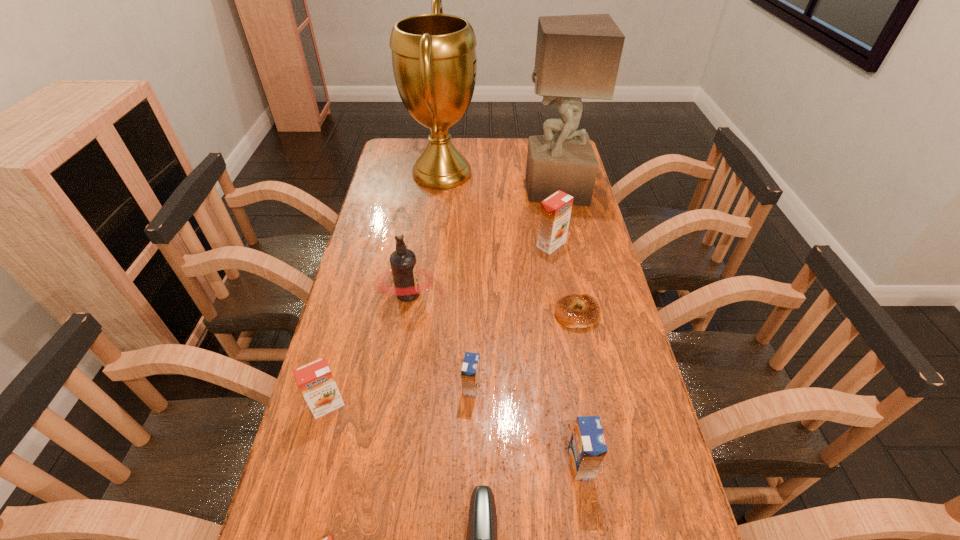
Identify the location of vacant region located 0.390m on the back of the third nearest object. This screenshot has height=540, width=960. (557, 314).

You are a GUI agent. You are given a task and a screenshot of the screen. Output one action in this format:
    pyautogui.click(x=<x>, y=<y>)
    Task: Click on the free space located on the right of the smaller blue orange_juice
    
    Given the screenshot: What is the action you would take?
    pyautogui.click(x=553, y=387)

Find the location of a particular element. vacant space situated 0.280m on the back of the shortest object is located at coordinates (562, 237).

Image resolution: width=960 pixels, height=540 pixels. I want to click on object present at the far edge, so click(x=434, y=62).

Image resolution: width=960 pixels, height=540 pixels. What are the coordinates of `trophy cup situated at the left edge` in the screenshot? It's located at (434, 62).

Find the location of a particular element. The height and width of the screenshot is (540, 960). root beer at the left edge is located at coordinates (403, 263).

Image resolution: width=960 pixels, height=540 pixels. In order to click on orange juice located in the left edge section of the desktop in this screenshot , I will do `click(315, 380)`.

Find the location of a particular element. Image resolution: width=960 pixels, height=540 pixels. sculpture that is at the right edge is located at coordinates (577, 56).

In order to click on bagel situated at the right edge in this screenshot , I will do `click(589, 315)`.

You are a GUI agent. You are given a task and a screenshot of the screen. Output one action in this format:
    pyautogui.click(x=<x>, y=<y>)
    Task: Click on the object at the far left corner
    This screenshot has height=540, width=960.
    Given the screenshot: What is the action you would take?
    pyautogui.click(x=434, y=62)